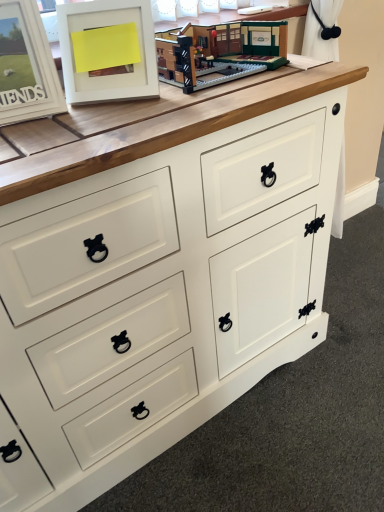
Question: Is brick-like lego set at upper center bigger than white matte picture frame at upper left, which is the second picture frame in right-to-left order?

Choices:
 (A) no
 (B) yes

Answer: (B)

Question: Is the depth of brick-like lego set at upper center less than that of white matte picture frame at upper left, which is the second picture frame in right-to-left order?

Choices:
 (A) no
 (B) yes

Answer: (A)

Question: Does brick-like lego set at upper center appear on the right side of white matte picture frame at upper left, which is the second picture frame in right-to-left order?

Choices:
 (A) yes
 (B) no

Answer: (A)

Question: From the image's perspective, is brick-like lego set at upper center below white matte picture frame at upper left, which is the second picture frame in right-to-left order?

Choices:
 (A) no
 (B) yes

Answer: (A)

Question: Can you confirm if brick-like lego set at upper center is thinner than white matte picture frame at upper left, the first picture frame from the left?

Choices:
 (A) yes
 (B) no

Answer: (B)

Question: In the image, is brick-like lego set at upper center positioned in front of or behind white matte picture frame at upper left, the second picture frame positioned from the left?

Choices:
 (A) behind
 (B) front

Answer: (A)

Question: Considering the positions of brick-like lego set at upper center and white matte picture frame at upper left, the second picture frame positioned from the left, in the image, is brick-like lego set at upper center taller or shorter than white matte picture frame at upper left, the second picture frame positioned from the left,?

Choices:
 (A) tall
 (B) short

Answer: (B)

Question: Is brick-like lego set at upper center wider or thinner than white matte picture frame at upper left, the second picture frame positioned from the left?

Choices:
 (A) thin
 (B) wide

Answer: (B)

Question: From the image's perspective, is brick-like lego set at upper center located above or below white matte picture frame at upper left, the second picture frame positioned from the left?

Choices:
 (A) below
 (B) above

Answer: (B)

Question: Is white matte picture frame at upper left, the first picture frame from the left, to the left or to the right of brick-like lego set at upper center in the image?

Choices:
 (A) right
 (B) left

Answer: (B)

Question: In terms of size, does white matte picture frame at upper left, the first picture frame from the left, appear bigger or smaller than brick-like lego set at upper center?

Choices:
 (A) small
 (B) big

Answer: (A)

Question: Choose the correct answer: Is white matte picture frame at upper left, the first picture frame from the left, inside brick-like lego set at upper center or outside it?

Choices:
 (A) inside
 (B) outside

Answer: (B)

Question: From a real-world perspective, is white matte picture frame at upper left, the first picture frame from the left, above or below brick-like lego set at upper center?

Choices:
 (A) above
 (B) below

Answer: (A)

Question: Would you say white matte picture frame at upper left, which is counted as the 1th picture frame, starting from the right, is to the left or to the right of brick-like lego set at upper center in the picture?

Choices:
 (A) right
 (B) left

Answer: (B)

Question: From their relative heights in the image, would you say white matte picture frame at upper left, the second picture frame positioned from the left, is taller or shorter than brick-like lego set at upper center?

Choices:
 (A) short
 (B) tall

Answer: (B)